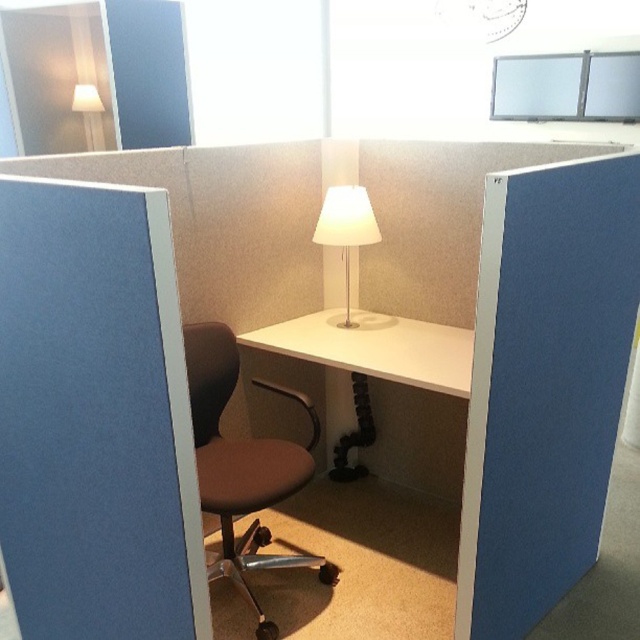
You are an office worker who needs to adjust the height of the white matte lamp at center to ensure it provides adequate lighting for the white glossy computer desk at center. Based on their positions, can you confirm if the lamp is placed directly above the desk?

The white glossy computer desk at center is positioned under the white matte lamp at center, so yes, the lamp is placed directly above the desk, allowing it to provide adequate lighting.

You are organizing the office supplies in the cubicle and need to place a large box that requires the same surface area as the white glossy computer desk at center. Is there enough space on the desk to accommodate the box without moving the white matte lamp at center?

The white glossy computer desk at center has a larger size compared to white matte lamp at center. Since the desk is larger, there should be enough space to place the large box that requires the same surface area as the desk, provided the lamp is not occupying that space. However, since the question specifies not moving the lamp, we must consider its placement. If the lamp is on the desk, the available space might be reduced. But according to the description, the desk is larger than the lamp, so even with a

You are standing at the entrance of the office cubicle and want to sit down at the desk. Which object at point (243, 465) is the closest to the desk?

The brown fabric swivel chair at center is located at point (243, 465), which is the closest to the desk.